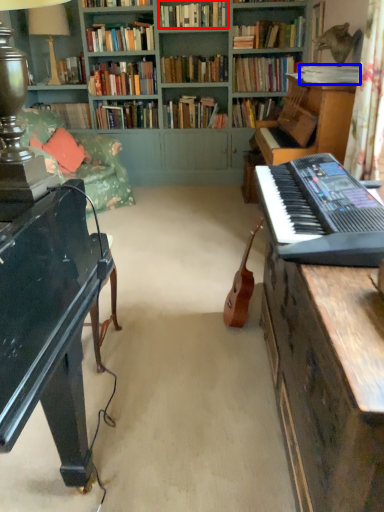
Question: Which of the following is the farthest to the observer, book (highlighted by a red box) or book (highlighted by a blue box)?

Choices:
 (A) book
 (B) book

Answer: (A)